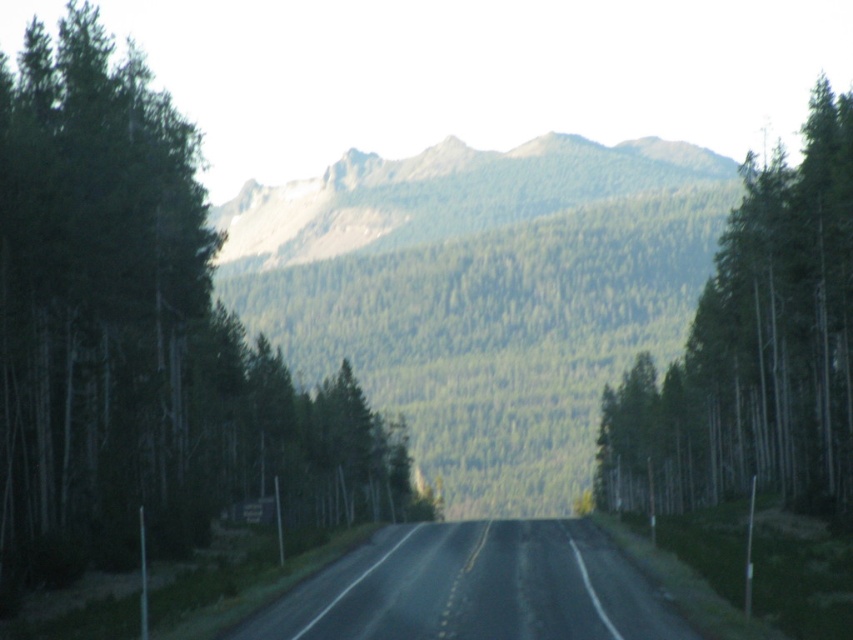
Question: Which point is closer to the camera taking this photo?

Choices:
 (A) (334, 248)
 (B) (670, 632)

Answer: (B)

Question: Estimate the real-world distances between objects in this image. Which object is farther from the green textured tree at left?

Choices:
 (A) green matte tree at right
 (B) green forested mountain at center
 (C) black asphalt road at center

Answer: (B)

Question: Is black asphalt road at center below green forested mountain at center?

Choices:
 (A) yes
 (B) no

Answer: (A)

Question: Does green matte tree at right appear under black asphalt road at center?

Choices:
 (A) yes
 (B) no

Answer: (B)

Question: Based on their relative distances, which object is nearer to the green forested mountain at center?

Choices:
 (A) green textured tree at left
 (B) black asphalt road at center

Answer: (A)

Question: Where is black asphalt road at center located in relation to green forested mountain at center in the image?

Choices:
 (A) left
 (B) right

Answer: (A)